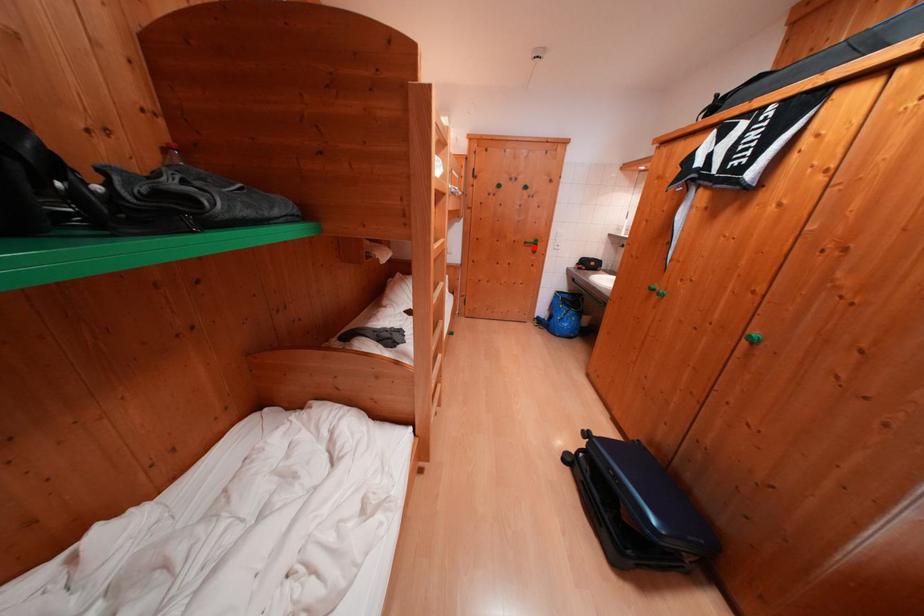
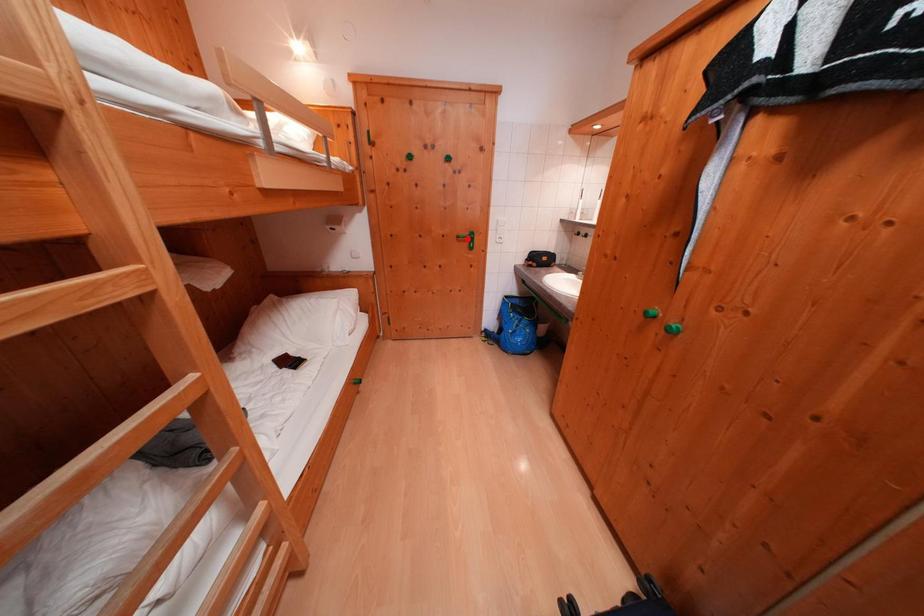
I am providing you with two images of the same scene from different viewpoints. A red point is marked on the first image and another point is marked on the second image. Do the highlighted points in image1 and image2 indicate the same real-world spot?

No